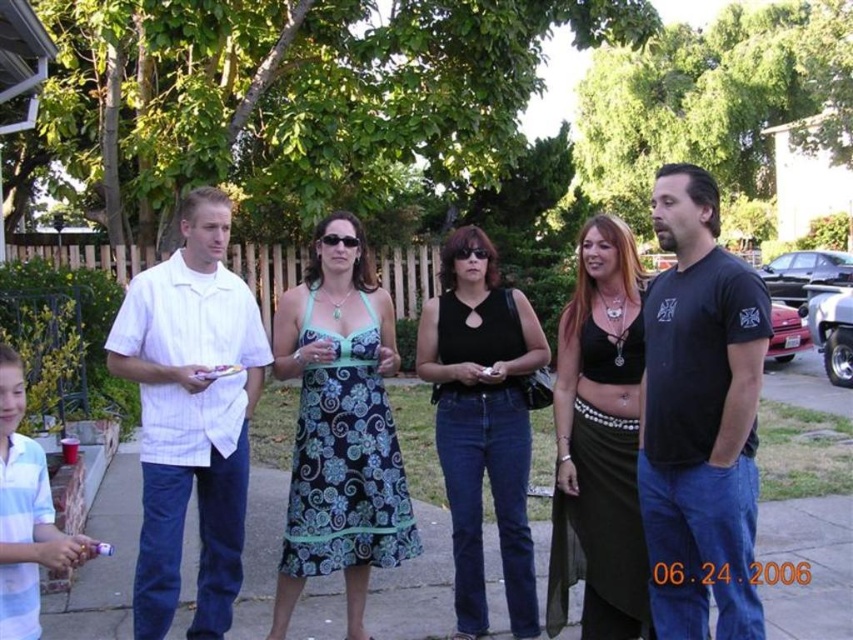
Between point (239, 406) and point (495, 413), which one is positioned in front?

Point (239, 406) is in front.

Does white striped shirt at left appear under black matte tank top at center?

No, white striped shirt at left is not below black matte tank top at center.

Which is behind, point (212, 637) or point (506, 301)?

Positioned behind is point (506, 301).

What are the coordinates of `white striped shirt at left` in the screenshot? It's located at (190, 416).

Is black cotton t-shirt at right to the right of black matte tank top at center from the viewer's perspective?

Yes, black cotton t-shirt at right is to the right of black matte tank top at center.

Which is more to the right, black cotton t-shirt at right or black matte tank top at center?

black cotton t-shirt at right

Where is `black cotton t-shirt at right`? black cotton t-shirt at right is located at coordinates (700, 417).

Consider the image. Is black sheer skirt at center closer to camera compared to black matte tank top at center?

Yes, black sheer skirt at center is in front of black matte tank top at center.

Is black sheer skirt at center bigger than black matte tank top at center?

Yes.

Measure the distance between black sheer skirt at center and camera.

black sheer skirt at center and camera are 12.78 feet apart.

The height and width of the screenshot is (640, 853). In order to click on black sheer skirt at center in this screenshot , I will do `click(599, 442)`.